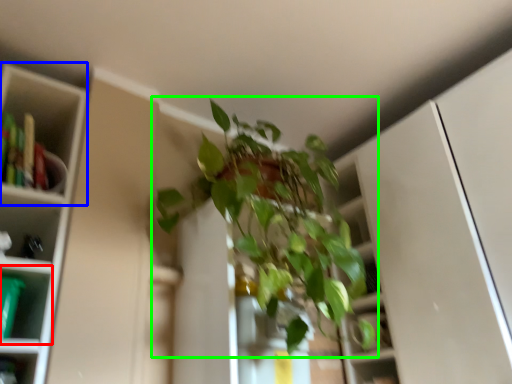
Question: Considering the real-world distances, which object is farthest from shelf (highlighted by a red box)? cabinet (highlighted by a blue box) or houseplant (highlighted by a green box)?

Choices:
 (A) cabinet
 (B) houseplant

Answer: (B)